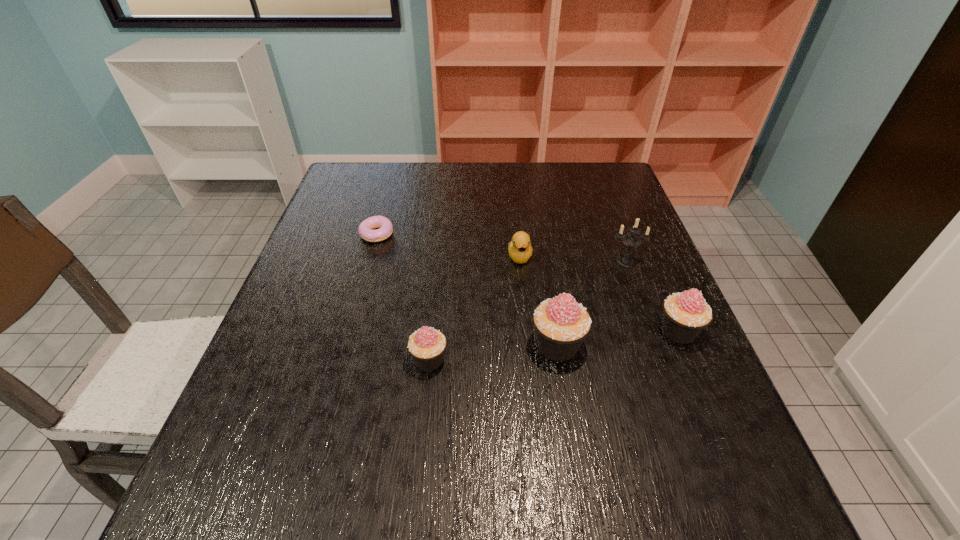
With all cupcakes evenly spaced, where should an extra cupcake be placed on the left to continue the pattern? Please point out a vacant space. Please provide its 2D coordinates. Your answer should be formatted as a tuple, i.e. [(x, y)], where the tuple contains the x and y coordinates of a point satisfying the conditions above.

[(293, 376)]